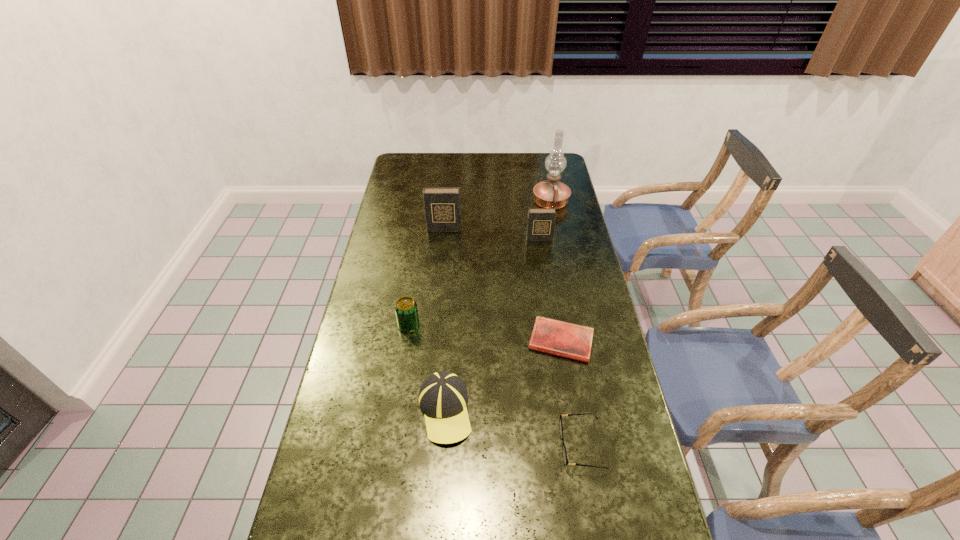
Image resolution: width=960 pixels, height=540 pixels. In order to click on vacant space located on the front-facing side of the spectacles in this screenshot , I will do `click(426, 446)`.

Find the location of a particular element. The width and height of the screenshot is (960, 540). vacant space located on the left of the red diary is located at coordinates (462, 341).

Identify the location of object that is at the left edge. (406, 310).

Locate an element on the screen. oil lamp that is at the right edge is located at coordinates (547, 194).

In order to click on spectacles positioned at the right edge in this screenshot , I will do `click(564, 453)`.

Locate an element on the screen. Image resolution: width=960 pixels, height=540 pixels. vacant area at the far edge is located at coordinates (468, 157).

Where is `vacant space at the left edge`? vacant space at the left edge is located at coordinates (392, 333).

Image resolution: width=960 pixels, height=540 pixels. In the image, there is a desktop. What are the coordinates of `vacant space at the right edge` in the screenshot? It's located at (572, 232).

You are a GUI agent. You are given a task and a screenshot of the screen. Output one action in this format:
    pyautogui.click(x=<x>, y=<y>)
    Task: Click on the vacant space at the far left corner
    
    Given the screenshot: What is the action you would take?
    pyautogui.click(x=413, y=158)

Identify the location of vacant area that lies between the green beer can and the oil lamp. The width and height of the screenshot is (960, 540). (480, 264).